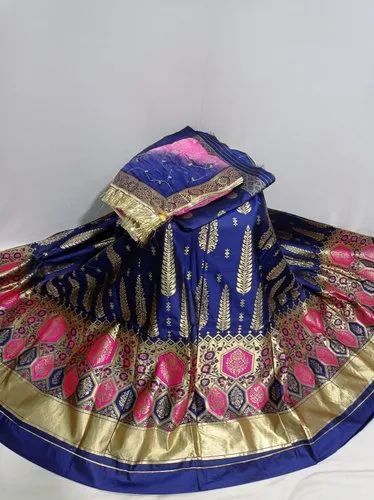
Image resolution: width=374 pixels, height=500 pixels. I want to click on bottom fabric, so click(x=211, y=368).